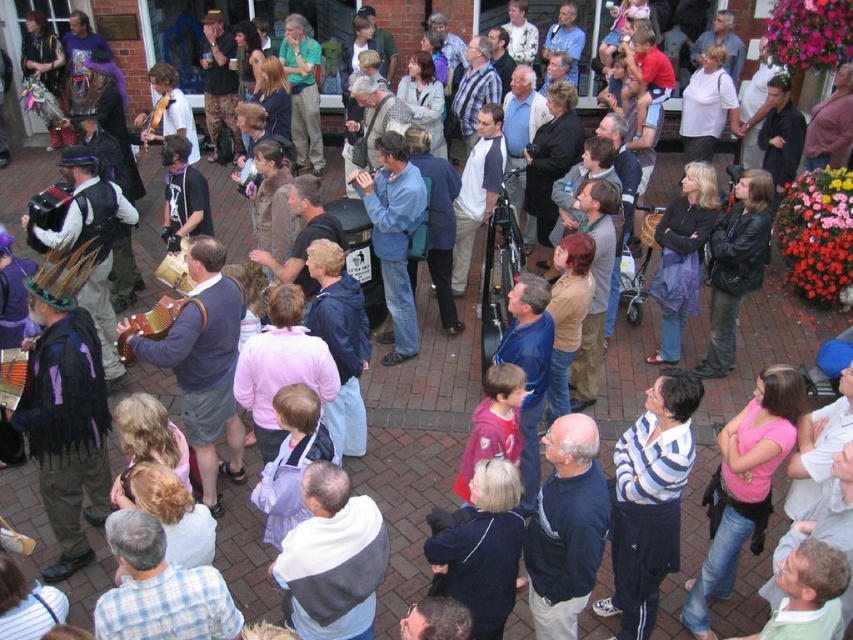
Question: Which point is closer to the camera?

Choices:
 (A) (399, 349)
 (B) (152, 321)
 (C) (144, 141)

Answer: (B)

Question: Can you confirm if brown leather accordion at center is positioned below blue denim shirt at center?

Choices:
 (A) yes
 (B) no

Answer: (A)

Question: Which point is closer to the camera taking this photo?

Choices:
 (A) (146, 317)
 (B) (70, 189)
 (C) (196, 452)
 (D) (397, 220)

Answer: (A)

Question: Does blue denim shirt at center appear over wooden acoustic guitar at center?

Choices:
 (A) no
 (B) yes

Answer: (A)

Question: Can you confirm if black fuzzy vest at lower left is thinner than matte brown accordion at center-left?

Choices:
 (A) no
 (B) yes

Answer: (A)

Question: Which of these objects is positioned closest to the black fuzzy vest at lower left?

Choices:
 (A) matte brown accordion at center-left
 (B) wooden acoustic guitar at center
 (C) wooden brown accordion at center

Answer: (C)